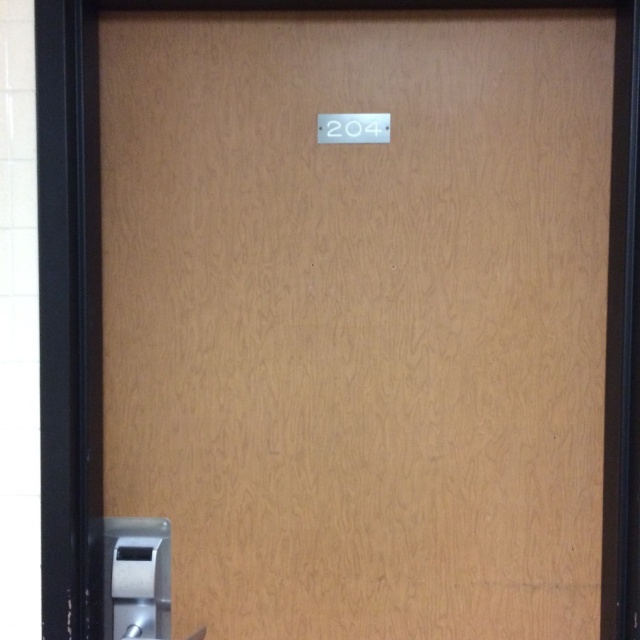
Question: Is satin nickel door handle at bottom left closer to the viewer compared to white glossy door lock at upper center?

Choices:
 (A) no
 (B) yes

Answer: (B)

Question: Is satin nickel door handle at bottom left further to camera compared to white glossy door lock at upper center?

Choices:
 (A) yes
 (B) no

Answer: (B)

Question: Which object appears closest to the camera in this image?

Choices:
 (A) satin nickel door handle at bottom left
 (B) white glossy door lock at upper center

Answer: (A)

Question: Does satin nickel door handle at bottom left have a lesser width compared to white glossy door lock at upper center?

Choices:
 (A) yes
 (B) no

Answer: (B)